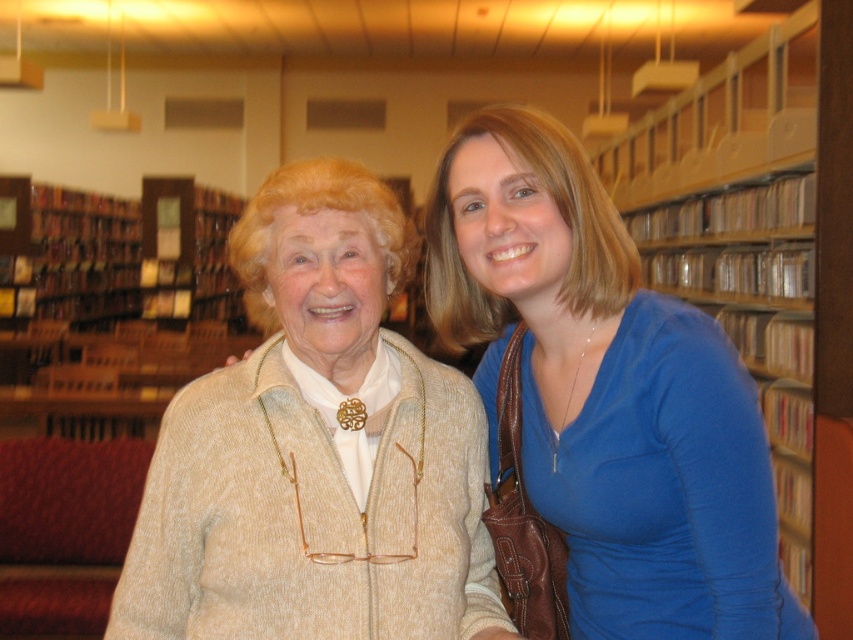
Question: Is the position of blue smooth shirt at center more distant than that of wooden shelves at upper center?

Choices:
 (A) yes
 (B) no

Answer: (B)

Question: Among these objects, which one is nearest to the camera?

Choices:
 (A) beige textured sweater at center
 (B) blue smooth shirt at center

Answer: (B)

Question: Which point is farther to the camera?

Choices:
 (A) (682, 541)
 (B) (775, 132)

Answer: (B)

Question: Does beige textured sweater at center have a smaller size compared to wooden shelves at upper center?

Choices:
 (A) yes
 (B) no

Answer: (A)

Question: Does beige textured sweater at center appear over blue smooth shirt at center?

Choices:
 (A) no
 (B) yes

Answer: (B)

Question: Which of the following is the farthest from the observer?

Choices:
 (A) beige textured sweater at center
 (B) blue smooth shirt at center
 (C) wooden shelves at upper center

Answer: (C)